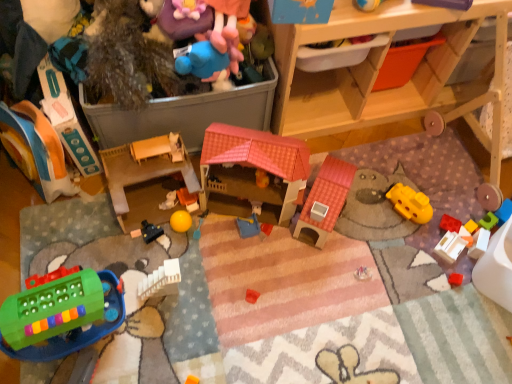
Find the location of a particular element. This screenshot has height=384, width=512. free space between white matte block at lower right, positioned as the second toy in right-to-left order, and yellow rubber ball at center, the 6th toy from the left is located at coordinates (x=325, y=240).